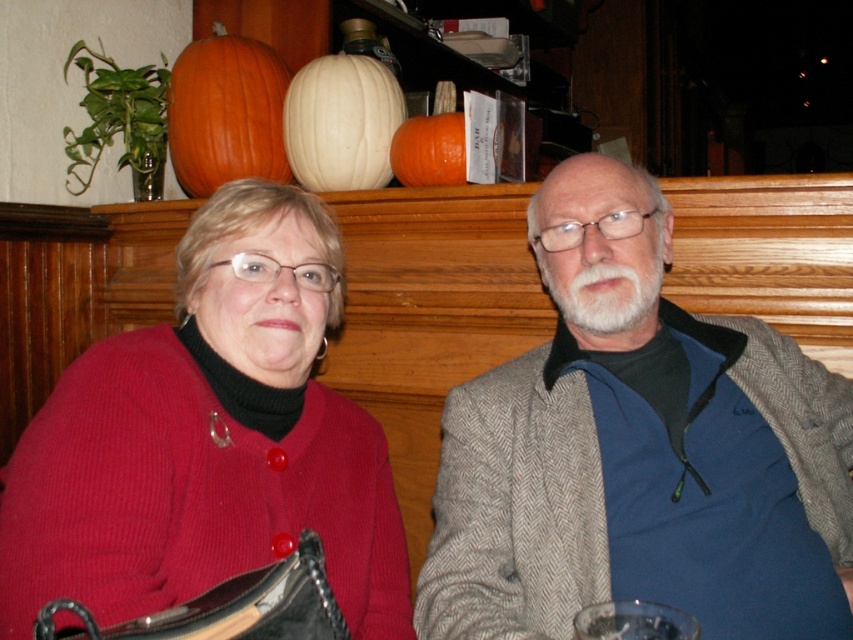
You are standing in front of the image and want to locate the blue woolen sweater at right. Where exactly is it located in the image?

The blue woolen sweater at right is located at point coordinates of (x=636, y=449).

You are a photographer setting up for a group photo. You notice an orange matte pumpkin at upper left and a white matte pumpkin at upper center in the background. Which pumpkin should you adjust to ensure both are visible in the frame?

The orange matte pumpkin at upper left is much taller than the white matte pumpkin at upper center, so you should lower the orange matte pumpkin at upper left to ensure both are visible in the frame.